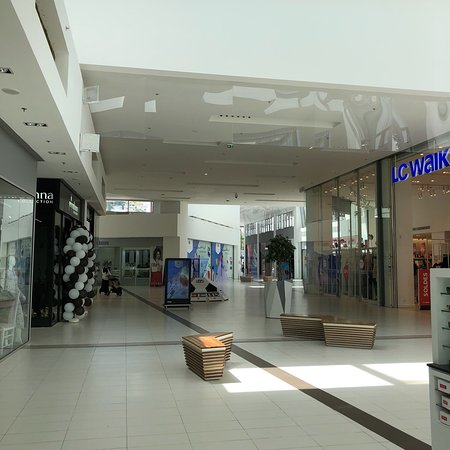
Image resolution: width=450 pixels, height=450 pixels. Find the location of `clothing store`. clothing store is located at coordinates (420, 260), (343, 259), (12, 303).